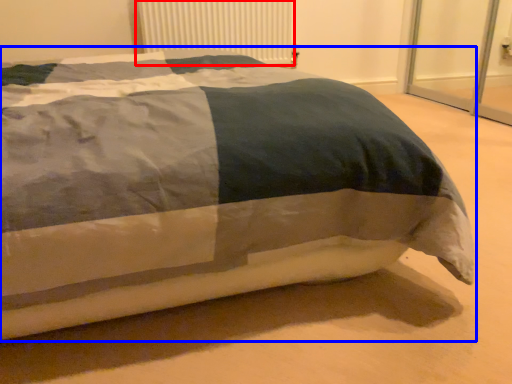
Question: Which point is closer to the camera, radiator (highlighted by a red box) or bed (highlighted by a blue box)?

Choices:
 (A) radiator
 (B) bed

Answer: (B)